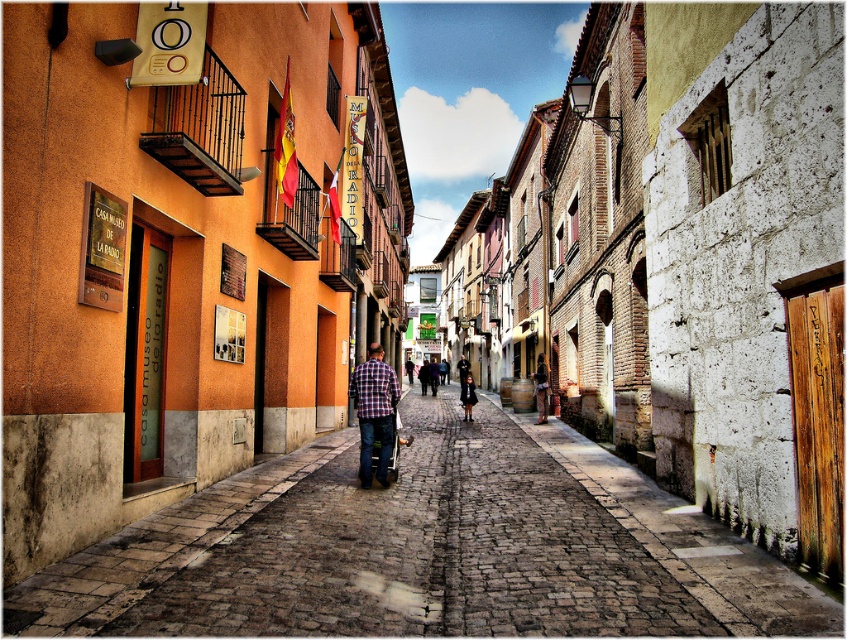
You are a tourist walking down the cobblestone street and see the plaid fabric shirt at center and the blue fabric cart at center. Which object is closer to you?

The plaid fabric shirt at center is closer to you since it is in front of the blue fabric cart at center.

You are standing at the entrance of the orange building on the left. You see the plaid fabric shirt at center and the aged structure on the right. Which one is closer to you?

The plaid fabric shirt at center is closer to you than the aged structure on the right because they are 9.31 meters apart.

You are a tourist standing on the cobblestone street and want to take a photo of the plaid fabric shirt at center and the blue fabric cart at center. Which object should you focus on first if you want to capture both in the frame without moving the camera?

The plaid fabric shirt at center is positioned on the left side of the blue fabric cart at center, so you should focus on the plaid fabric shirt at center first to ensure both are in frame.